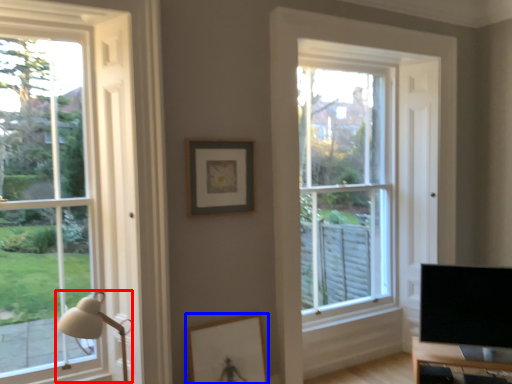
Question: Which object is further to the camera taking this photo, table lamp (highlighted by a red box) or picture frame (highlighted by a blue box)?

Choices:
 (A) table lamp
 (B) picture frame

Answer: (B)